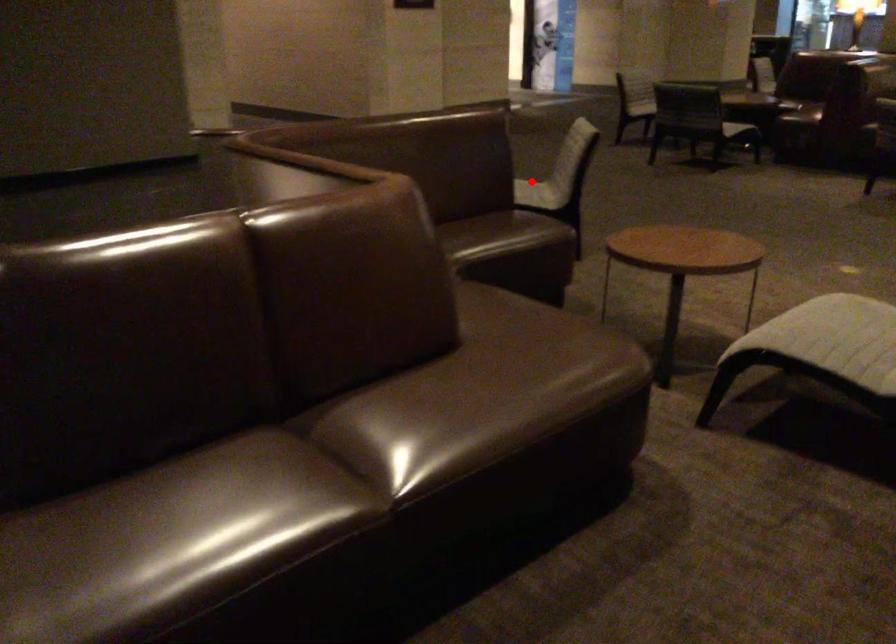
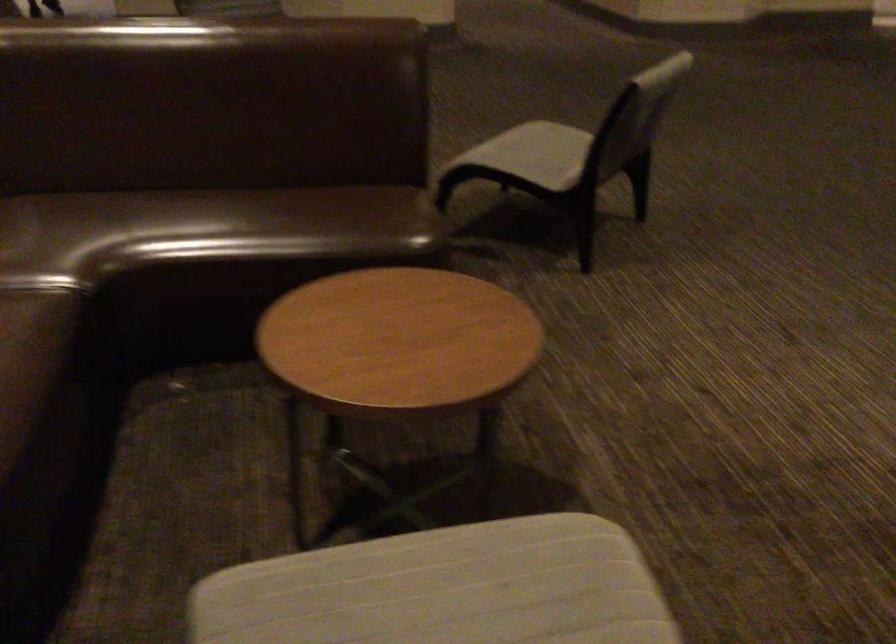
Locate, in the second image, the point that corresponds to the highlighted location in the first image.

(533, 154)